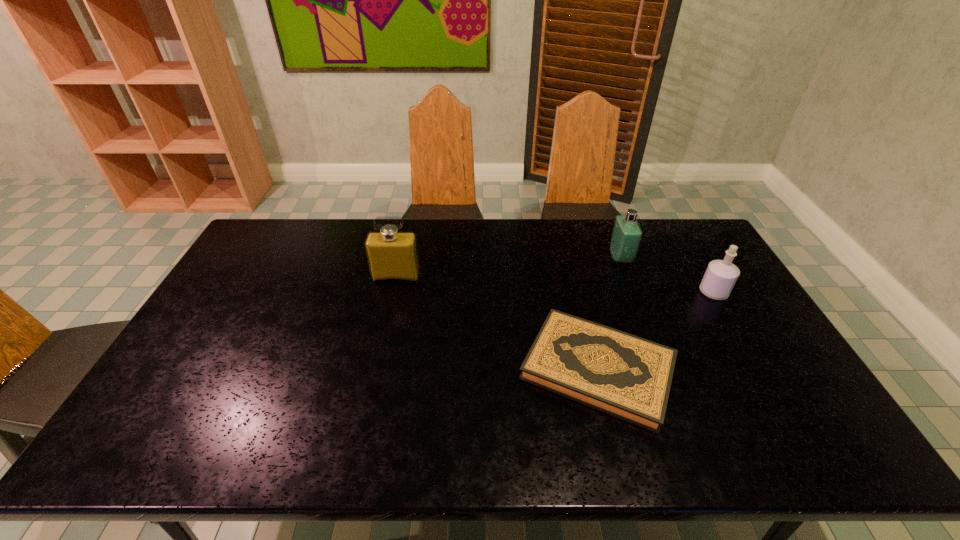
You are a GUI agent. You are given a task and a screenshot of the screen. Output one action in this format:
    pyautogui.click(x=<x>, y=<y>)
    Task: Click on the free space that satisfies the following two spatial constraints: 1. on the front label of the second perfume from left to right; 2. on the left side of the rightmost object
    This screenshot has width=960, height=540.
    Given the screenshot: What is the action you would take?
    pyautogui.click(x=634, y=292)

In order to click on vacant point that satisfies the following two spatial constraints: 1. on the front-facing side of the rightmost object; 2. on the left side of the leftmost perfume in this screenshot , I will do `click(393, 292)`.

Where is `free space that satisfies the following two spatial constraints: 1. on the front label of the second perfume from right to left; 2. on the front side of the hardback book`? The width and height of the screenshot is (960, 540). free space that satisfies the following two spatial constraints: 1. on the front label of the second perfume from right to left; 2. on the front side of the hardback book is located at coordinates (662, 369).